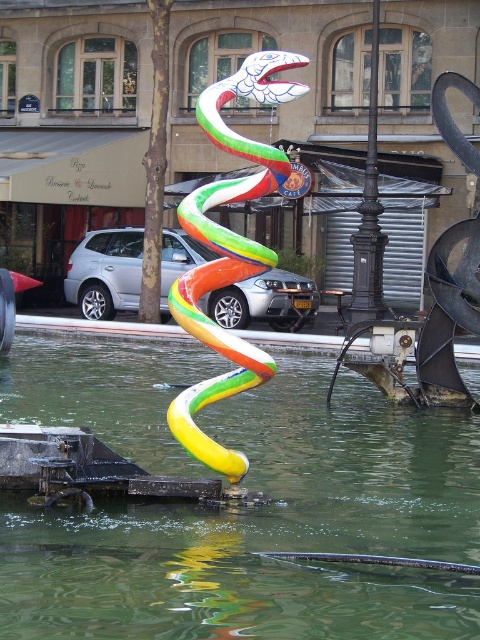
Is multicolored glossy snake at center below silver metallic suv at center?

Correct, multicolored glossy snake at center is located below silver metallic suv at center.

Can you confirm if multicolored glossy snake at center is positioned to the right of silver metallic suv at center?

Correct, you'll find multicolored glossy snake at center to the right of silver metallic suv at center.

Is point (231, 253) farther from camera compared to point (228, 305)?

No, it is in front of (228, 305).

This screenshot has height=640, width=480. Identify the location of multicolored glossy snake at center. (228, 252).

Between silver metallic suv at center and black wrought iron pole at center, which one appears on the right side from the viewer's perspective?

black wrought iron pole at center is more to the right.

Between point (243, 323) and point (364, 225), which one is positioned behind?

Positioned behind is point (243, 323).

What are the coordinates of `silver metallic suv at center` in the screenshot? It's located at (106, 273).

This screenshot has height=640, width=480. Describe the element at coordinates (269, 531) in the screenshot. I see `translucent green water at center` at that location.

Between point (155, 417) and point (372, 179), which one is positioned in front?

Positioned in front is point (155, 417).

The image size is (480, 640). What do you see at coordinates (269, 531) in the screenshot?
I see `translucent green water at center` at bounding box center [269, 531].

Identify the location of translucent green water at center. (269, 531).